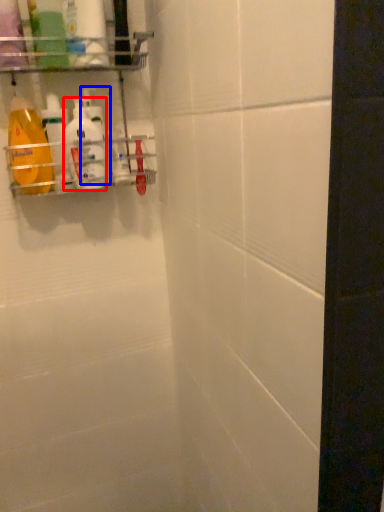
Question: Which of the following is the closest to the observer, cleaning product (highlighted by a red box) or cleaning product (highlighted by a blue box)?

Choices:
 (A) cleaning product
 (B) cleaning product

Answer: (A)